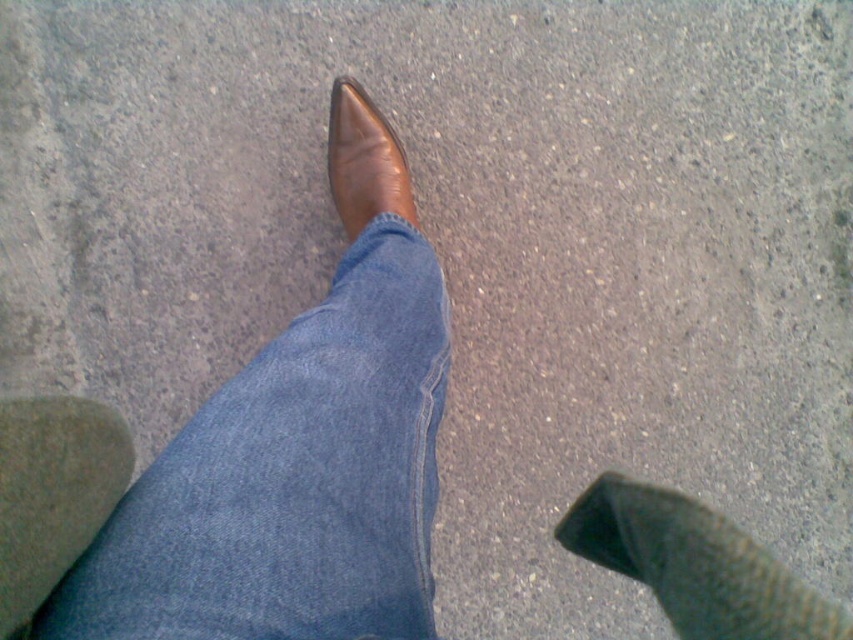
Can you confirm if denim at center is taller than green suede sock at lower left?

Correct, denim at center is much taller as green suede sock at lower left.

Between point (415, 243) and point (44, 438), which one is positioned in front?

Point (44, 438) is in front.

Locate an element on the screen. denim at center is located at coordinates (291, 481).

Which is below, green textured sock at lower right or brown leather shoe at center?

green textured sock at lower right

What do you see at coordinates (694, 564) in the screenshot?
I see `green textured sock at lower right` at bounding box center [694, 564].

Who is more forward, (837,637) or (393,164)?

Positioned in front is point (837,637).

The width and height of the screenshot is (853, 640). I want to click on green textured sock at lower right, so click(694, 564).

Can you confirm if green suede sock at lower left is thinner than brown leather shoe at center?

Correct, green suede sock at lower left's width is less than brown leather shoe at center's.

You are a GUI agent. You are given a task and a screenshot of the screen. Output one action in this format:
    pyautogui.click(x=<x>, y=<y>)
    Task: Click on the green suede sock at lower left
    This screenshot has width=853, height=640.
    Given the screenshot: What is the action you would take?
    pyautogui.click(x=53, y=493)

Which is behind, point (68, 435) or point (350, 200)?

Point (350, 200)

Where is `green suede sock at lower left`? The height and width of the screenshot is (640, 853). green suede sock at lower left is located at coordinates (53, 493).